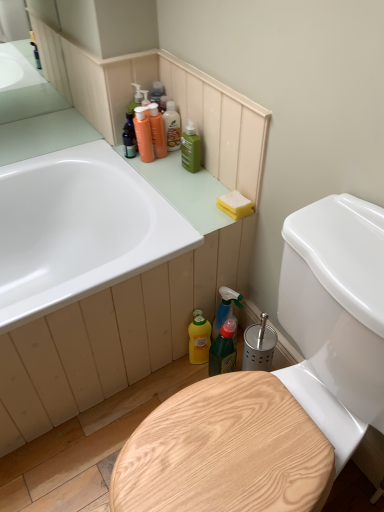
Where is `vacant space that's between yellow sponge at upper right and matte orange bottles at upper left, marked as the 4th cleaning product in a bottom-to-top arrangement`? The width and height of the screenshot is (384, 512). vacant space that's between yellow sponge at upper right and matte orange bottles at upper left, marked as the 4th cleaning product in a bottom-to-top arrangement is located at coordinates (188, 179).